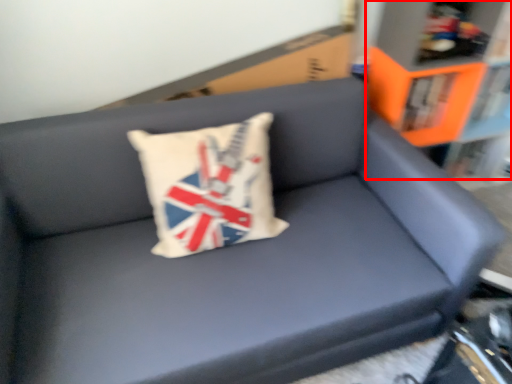
Question: Where is bookcase (annotated by the red box) located in relation to pillow in the image?

Choices:
 (A) right
 (B) left

Answer: (A)